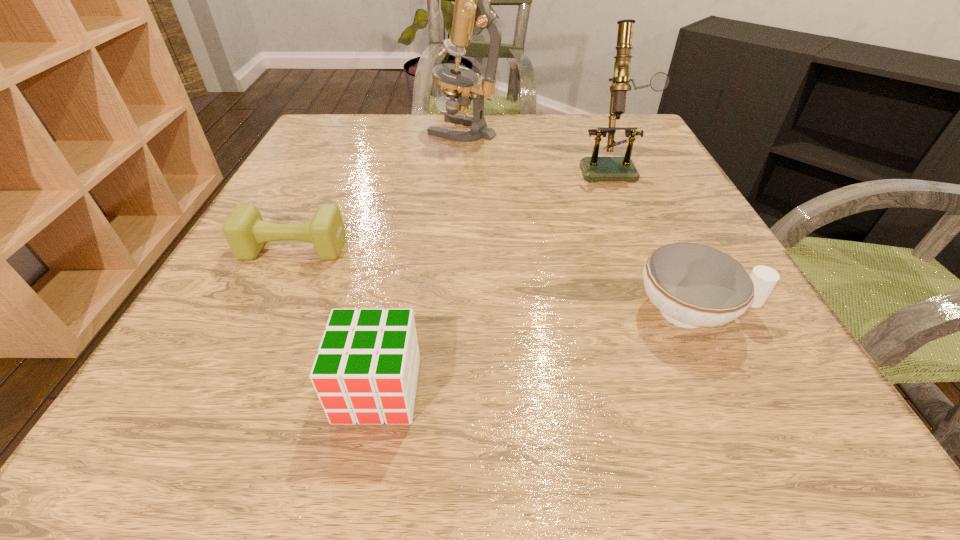
Identify the location of the farthest object. Image resolution: width=960 pixels, height=540 pixels. (461, 85).

The image size is (960, 540). I want to click on the taller microscope, so click(461, 85).

Locate an element on the screen. Image resolution: width=960 pixels, height=540 pixels. the right microscope is located at coordinates (594, 168).

The image size is (960, 540). In order to click on the shorter microscope in this screenshot , I will do `click(594, 168)`.

Where is `the third shortest object`? Image resolution: width=960 pixels, height=540 pixels. the third shortest object is located at coordinates (365, 371).

Where is `cube`? This screenshot has width=960, height=540. cube is located at coordinates click(365, 371).

Where is `the fourth farthest object`? the fourth farthest object is located at coordinates (693, 285).

The image size is (960, 540). What are the coordinates of `the leftmost object` in the screenshot? It's located at (245, 231).

Locate an element on the screen. Image resolution: width=960 pixels, height=540 pixels. the third nearest object is located at coordinates (245, 231).

This screenshot has width=960, height=540. In order to click on vacant area situated on the front of the farthest object in this screenshot , I will do `click(459, 199)`.